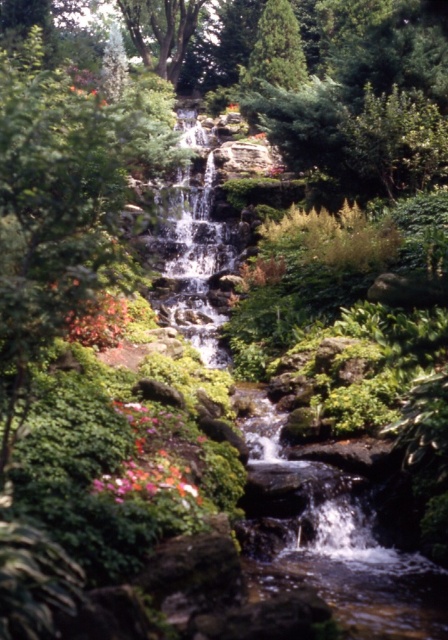
Question: Which object appears closest to the camera in this image?

Choices:
 (A) clear water at center
 (B) pink matte flowers at lower left

Answer: (B)

Question: Which of the following is the farthest from the observer?

Choices:
 (A) (153, 476)
 (B) (125, 476)
 (C) (193, 138)

Answer: (C)

Question: Can you confirm if clear water at center is positioned below pink matte flowers at lower left?

Choices:
 (A) yes
 (B) no

Answer: (B)

Question: Which of the following is the farthest from the observer?

Choices:
 (A) (121, 467)
 (B) (184, 330)

Answer: (B)

Question: Can you confirm if clear water at center is positioned to the right of vibrant floral bouquet at center?

Choices:
 (A) yes
 (B) no

Answer: (B)

Question: Observing the image, what is the correct spatial positioning of clear water at center in reference to pink matte flowers at lower left?

Choices:
 (A) right
 (B) left

Answer: (B)